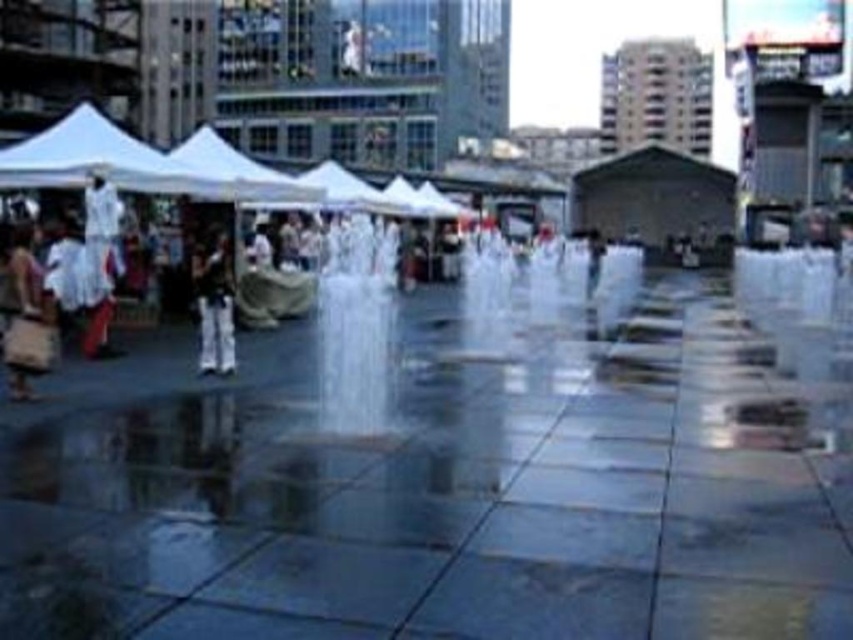
Question: Observing the image, what is the correct spatial positioning of white cotton dress at left in reference to dark blue jeans at center?

Choices:
 (A) left
 (B) right

Answer: (A)

Question: Which point is closer to the camera taking this photo?

Choices:
 (A) (312, 189)
 (B) (99, 352)

Answer: (B)

Question: Does brown fabric bag at left have a larger size compared to white fabric canopy at center?

Choices:
 (A) no
 (B) yes

Answer: (A)

Question: Is brown fabric bag at left wider than white cotton dress at left?

Choices:
 (A) yes
 (B) no

Answer: (A)

Question: Among these objects, which one is nearest to the camera?

Choices:
 (A) white fabric canopy at center
 (B) white cotton dress at left
 (C) brown fabric bag at left
 (D) dark blue jeans at center

Answer: (C)

Question: Which point is closer to the camera?

Choices:
 (A) (273, 170)
 (B) (97, 259)
 (C) (219, 273)

Answer: (C)